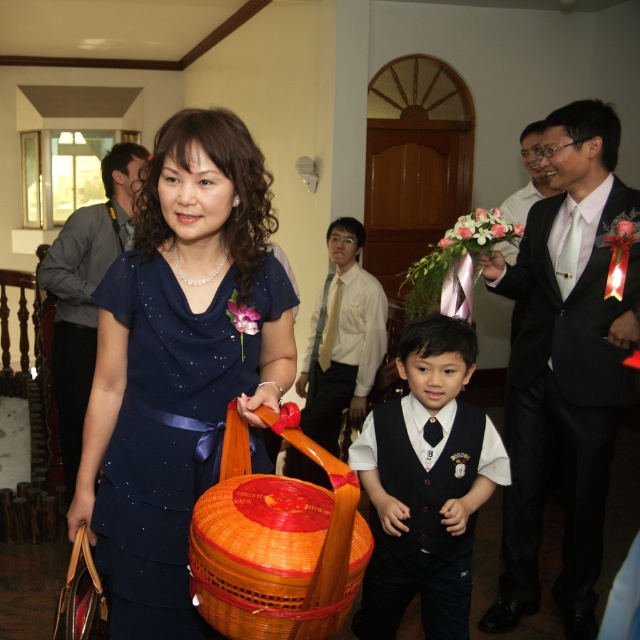
The height and width of the screenshot is (640, 640). What do you see at coordinates (424, 484) in the screenshot?
I see `matte black vest at center` at bounding box center [424, 484].

You are a GUI agent. You are given a task and a screenshot of the screen. Output one action in this format:
    pyautogui.click(x=<x>, y=<y>)
    Task: Click on the matte black vest at center
    
    Given the screenshot: What is the action you would take?
    pyautogui.click(x=424, y=484)

Which is in front, point (506, 458) or point (67, 232)?

Point (506, 458)

Does point (468, 545) lie behind point (132, 198)?

Yes, it is behind point (132, 198).

Is point (396, 534) closer to camera compared to point (124, 195)?

That is True.

At what (x,y) coordinates should I click in order to perform the action: click on matte black vest at center. Please return your answer as a coordinate pair (x, y). The image size is (640, 640). Looking at the image, I should click on (424, 484).

Does navy blue satin dress at center appear on the right side of bright orange woven basket at center?

No, navy blue satin dress at center is not to the right of bright orange woven basket at center.

Between point (140, 252) and point (211, 579), which one is positioned behind?

Positioned behind is point (140, 252).

Image resolution: width=640 pixels, height=640 pixels. Identify the location of navy blue satin dress at center. (170, 428).